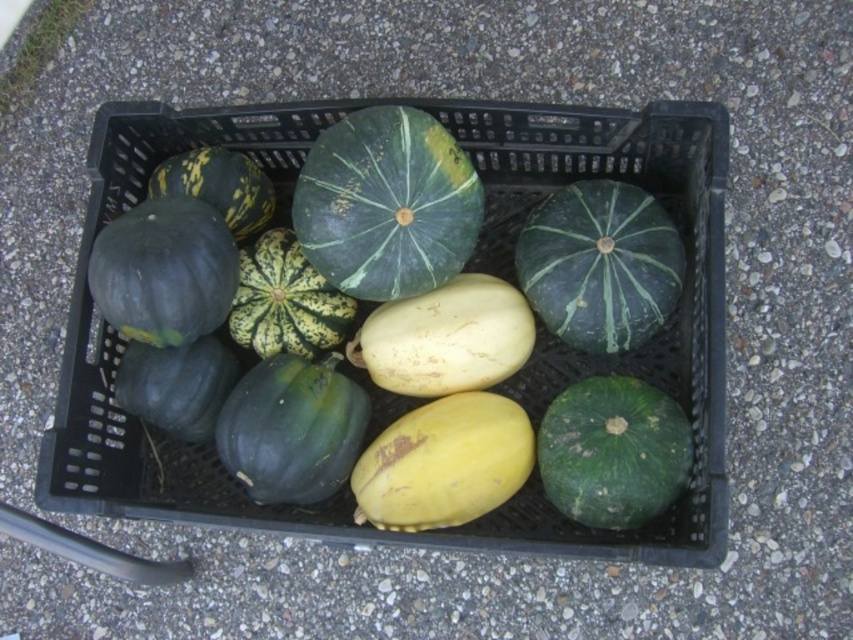
You are standing in a garden and see the black plastic basket at center and the green matte squash at center. Which object is positioned to the east?

The black plastic basket at center is to the right of the green matte squash at center, so if you are facing the scene, the black plastic basket at center would be positioned to the east if the green matte squash at center is to the west.

You are standing in front of the black plastic basket at center and want to pick up the green matte squash at center. Can you reach it without moving the basket?

The black plastic basket at center is closer to the viewer than green matte squash at center, so you cannot reach the green matte squash at center without moving the basket.

You are a delivery person who needs to place a package between the black plastic basket at center and the green matte squash at center. The package is 20 centimeters long. Can you fit it between them without moving either object?

The distance between the black plastic basket at center and the green matte squash at center is 19.85 centimeters. Since the package is 20 centimeters long, it cannot fit between them without moving either object because the space is slightly smaller than the package.